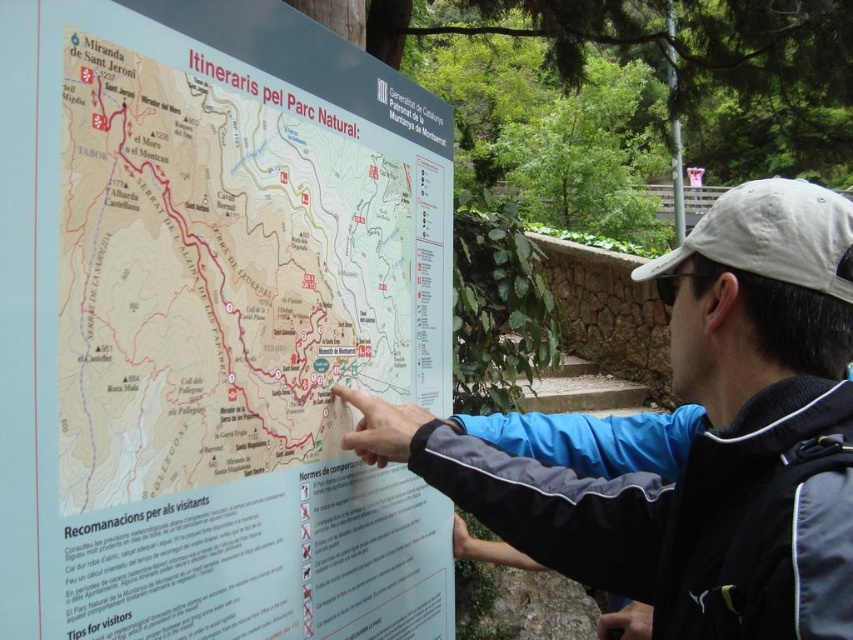
Question: Does light blue plastic sign at center come behind blue fabric jacket at center?

Choices:
 (A) no
 (B) yes

Answer: (B)

Question: Among these objects, which one is nearest to the camera?

Choices:
 (A) blue fabric jacket at center
 (B) light blue plastic sign at center

Answer: (A)

Question: Among these points, which one is farthest from the camera?

Choices:
 (A) (3, 582)
 (B) (753, 348)

Answer: (B)

Question: Can you confirm if light blue plastic sign at center is wider than blue fabric jacket at center?

Choices:
 (A) no
 (B) yes

Answer: (A)

Question: Does light blue plastic sign at center have a lesser width compared to blue fabric jacket at center?

Choices:
 (A) yes
 (B) no

Answer: (A)

Question: Which point appears farthest from the camera in this image?

Choices:
 (A) [x=4, y=310]
 (B) [x=634, y=516]

Answer: (B)